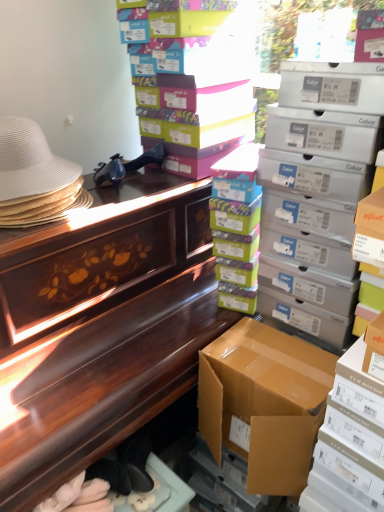
Question: Can you confirm if multicolored cardboard boxes at center, the 3th box positioned from the top, is bigger than white woven hat at left?

Choices:
 (A) yes
 (B) no

Answer: (B)

Question: Is multicolored cardboard boxes at center, the 3th box positioned from the top, taller than white woven hat at left?

Choices:
 (A) yes
 (B) no

Answer: (A)

Question: Are multicolored cardboard boxes at center, acting as the 3th box starting from the bottom, and white woven hat at left beside each other?

Choices:
 (A) yes
 (B) no

Answer: (B)

Question: Is multicolored cardboard boxes at center, the 3th box positioned from the top, positioned beyond the bounds of white woven hat at left?

Choices:
 (A) no
 (B) yes

Answer: (B)

Question: From the image's perspective, would you say multicolored cardboard boxes at center, acting as the 3th box starting from the bottom, is shown under white woven hat at left?

Choices:
 (A) yes
 (B) no

Answer: (A)

Question: From a real-world perspective, relative to brown cardboard box at lower right, the 2th box in the bottom-to-top sequence, is matte cardboard box at upper right, marked as the second box in a top-to-bottom arrangement, vertically above or below?

Choices:
 (A) above
 (B) below

Answer: (A)

Question: Is matte cardboard box at upper right, which is counted as the 4th box, starting from the bottom, to the left or to the right of brown cardboard box at lower right, the 2th box in the bottom-to-top sequence, in the image?

Choices:
 (A) right
 (B) left

Answer: (A)

Question: Would you say matte cardboard box at upper right, marked as the second box in a top-to-bottom arrangement, is inside or outside brown cardboard box at lower right, the 2th box in the bottom-to-top sequence?

Choices:
 (A) inside
 (B) outside

Answer: (B)

Question: In terms of height, does matte cardboard box at upper right, marked as the second box in a top-to-bottom arrangement, look taller or shorter compared to brown cardboard box at lower right, positioned as the fourth box in top-to-bottom order?

Choices:
 (A) short
 (B) tall

Answer: (B)

Question: In terms of height, does brown cardboard box at right, which is the first box from bottom to top, look taller or shorter compared to brown cardboard box at lower right, the 2th box in the bottom-to-top sequence?

Choices:
 (A) tall
 (B) short

Answer: (A)

Question: Is brown cardboard box at right, which is the first box from bottom to top, to the left or to the right of brown cardboard box at lower right, the 2th box in the bottom-to-top sequence, in the image?

Choices:
 (A) right
 (B) left

Answer: (A)

Question: Based on their sizes in the image, would you say brown cardboard box at right, which is the 5th box from top to bottom, is bigger or smaller than brown cardboard box at lower right, positioned as the fourth box in top-to-bottom order?

Choices:
 (A) small
 (B) big

Answer: (B)

Question: Is brown cardboard box at right, which is the 5th box from top to bottom, inside or outside of brown cardboard box at lower right, the 2th box in the bottom-to-top sequence?

Choices:
 (A) inside
 (B) outside

Answer: (B)

Question: Is matte cardboard box at upper right, marked as the second box in a top-to-bottom arrangement, taller or shorter than white woven hat at left?

Choices:
 (A) tall
 (B) short

Answer: (A)

Question: Based on their sizes in the image, would you say matte cardboard box at upper right, which is counted as the 4th box, starting from the bottom, is bigger or smaller than white woven hat at left?

Choices:
 (A) big
 (B) small

Answer: (A)